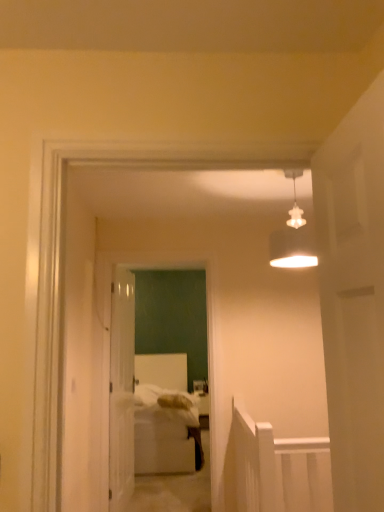
Question: Looking at their shapes, would you say white glossy door at center, placed as the 1th door when sorted from left to right, is wider or thinner than white glossy door at center?

Choices:
 (A) thin
 (B) wide

Answer: (A)

Question: Is white glossy door at center, marked as the 2th door in a right-to-left arrangement, taller or shorter than white glossy door at center?

Choices:
 (A) tall
 (B) short

Answer: (A)

Question: Estimate the real-world distances between objects in this image. Which object is farther from the white matte lampshade at upper center?

Choices:
 (A) white glossy door at center, which is the second door in front-to-back order
 (B) white soft bed at center
 (C) white matte door at right, acting as the second door starting from the left
 (D) white glossy door at center

Answer: (B)

Question: Which of these objects is positioned closest to the white matte lampshade at upper center?

Choices:
 (A) white soft bed at center
 (B) white matte door at right, which is counted as the 2th door, starting from the back
 (C) white glossy door at center
 (D) white glossy door at center, placed as the 1th door when sorted from left to right

Answer: (B)